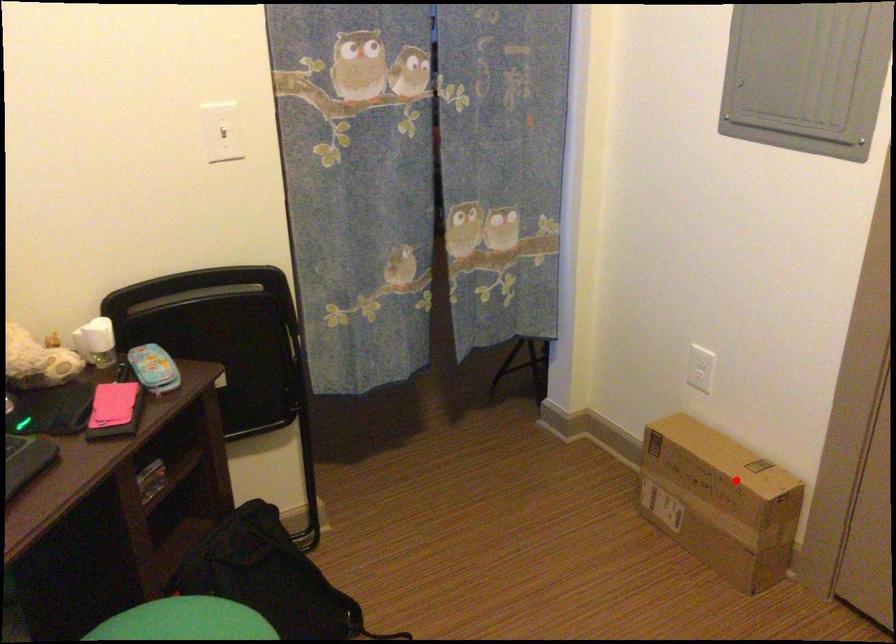
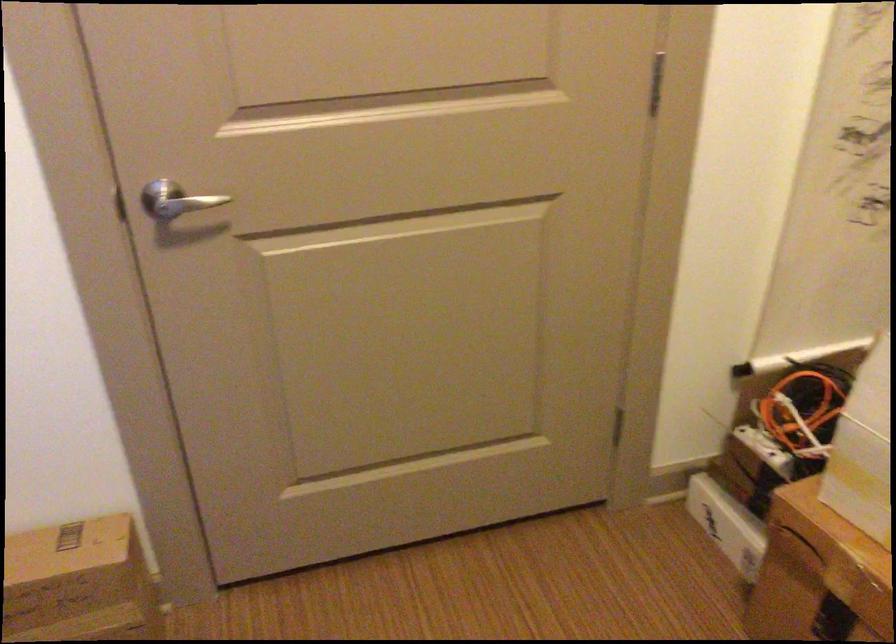
Question: I am providing you with two images of the same scene from different viewpoints. A red point is shown in image1. For the corresponding object point in image2, is it positioned nearer or farther from the camera?

Choices:
 (A) Nearer
 (B) Farther

Answer: (A)